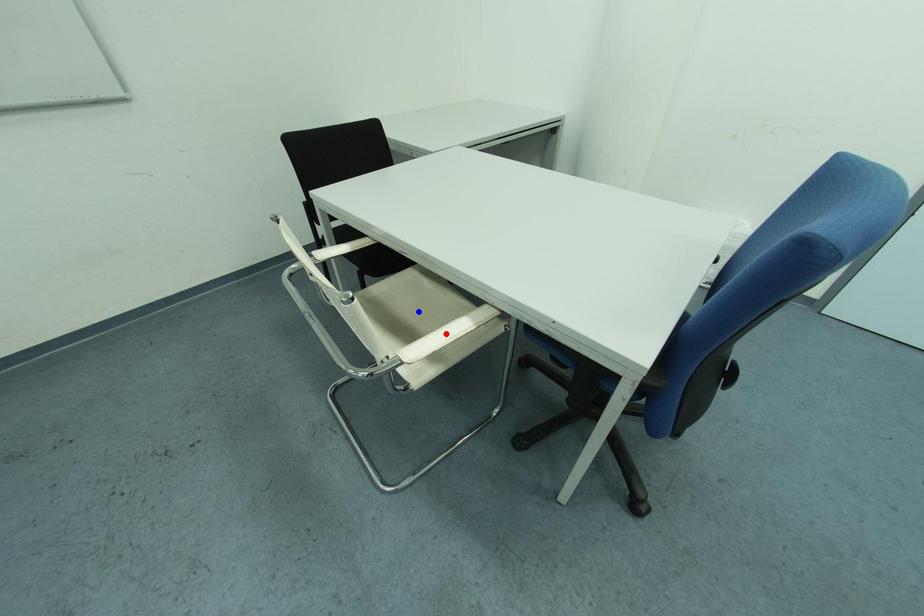
Question: Two points are marked on the image. Which point is closer to the camera?

Choices:
 (A) Blue point is closer.
 (B) Red point is closer.

Answer: (A)